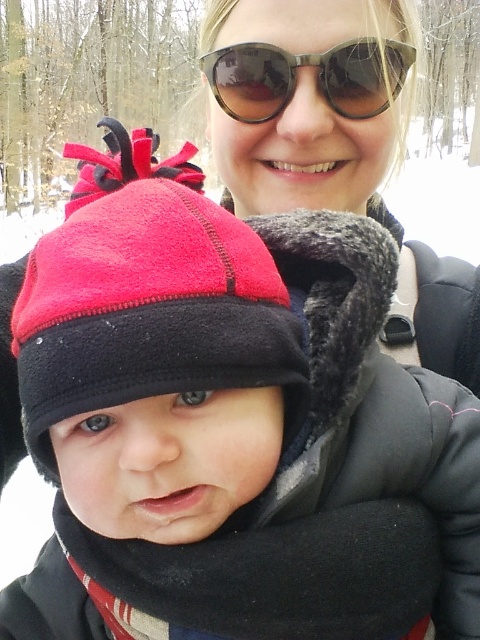
Question: Does red fleece hat at center have a lesser width compared to matte black sunglasses at upper center?

Choices:
 (A) no
 (B) yes

Answer: (B)

Question: Is red fleece hat at center smaller than sunglasses at upper center?

Choices:
 (A) yes
 (B) no

Answer: (B)

Question: Considering the relative positions of matte black sunglasses at upper center and sunglasses at upper center in the image provided, where is matte black sunglasses at upper center located with respect to sunglasses at upper center?

Choices:
 (A) below
 (B) above

Answer: (A)

Question: Which point appears closest to the camera in this image?

Choices:
 (A) (162, 202)
 (B) (448, 269)

Answer: (A)

Question: Among these objects, which one is farthest from the camera?

Choices:
 (A) sunglasses at upper center
 (B) matte black sunglasses at upper center

Answer: (B)

Question: Which of the following is the closest to the observer?

Choices:
 (A) (184, 259)
 (B) (280, 204)
 (C) (288, 77)

Answer: (A)